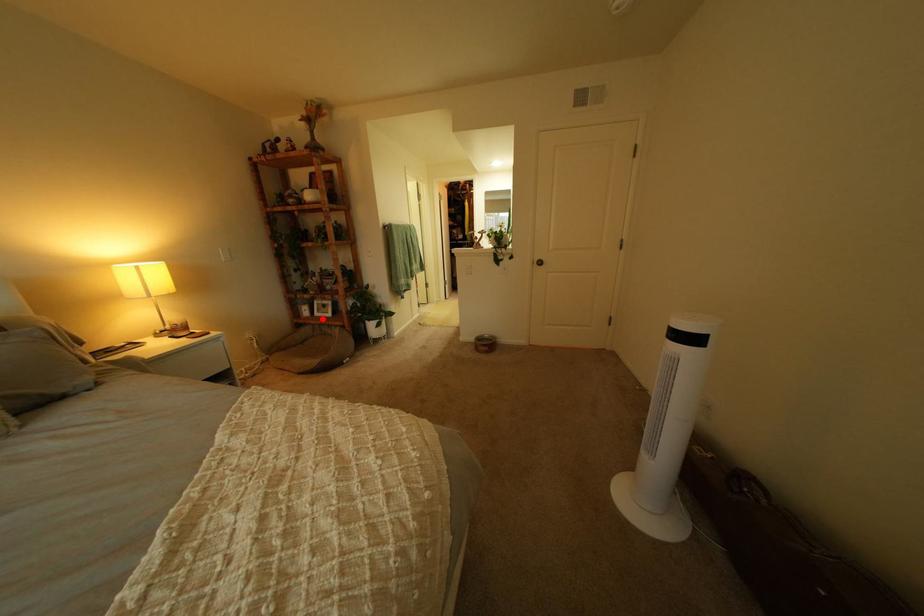
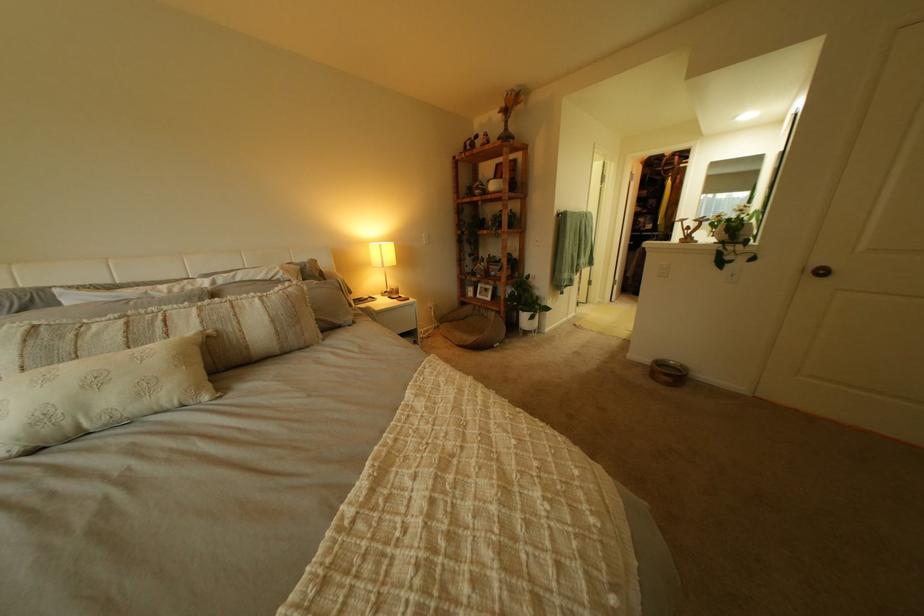
Question: A red point is marked in image1. In image2, is the corresponding 3D point closer to the camera or farther? Reply with the corresponding letter.

Choices:
 (A) The corresponding 3D point is closer.
 (B) The corresponding 3D point is farther.

Answer: (A)